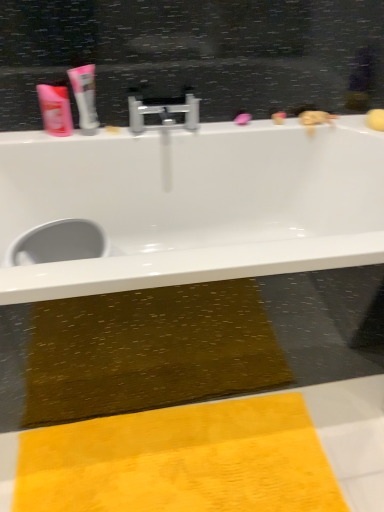
Locate an element on the screen. vacant area to the left of pink plastic shampoo at upper left is located at coordinates (33, 138).